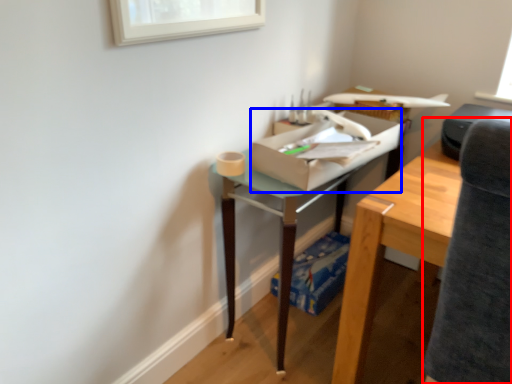
Question: Among these objects, which one is farthest to the camera, swivel chair (highlighted by a red box) or cardboard box (highlighted by a blue box)?

Choices:
 (A) swivel chair
 (B) cardboard box

Answer: (B)